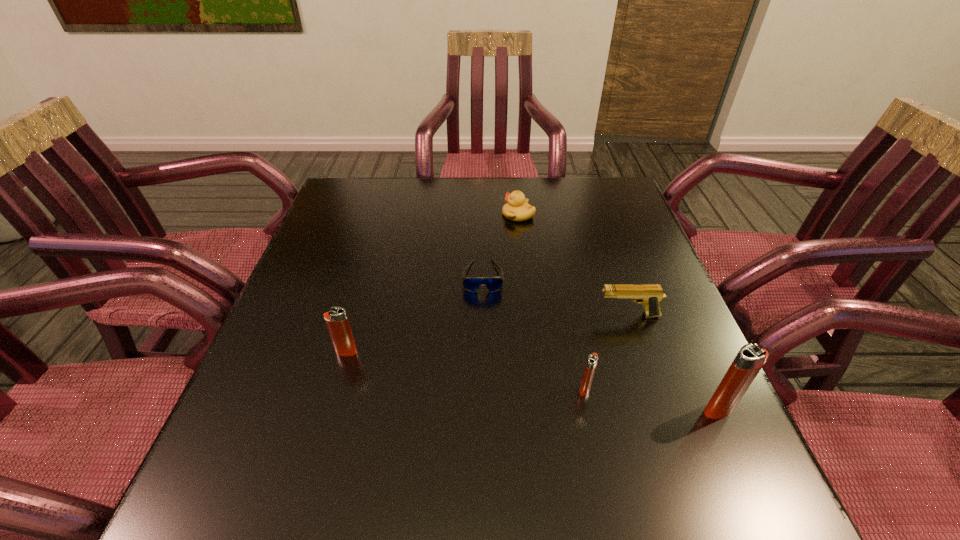
Where is `the second object from left to right`? The image size is (960, 540). the second object from left to right is located at coordinates (471, 283).

The image size is (960, 540). I want to click on the shortest object, so click(x=471, y=283).

This screenshot has height=540, width=960. I want to click on free region located on the back of the fifth shortest object, so click(371, 266).

This screenshot has height=540, width=960. In order to click on vacant space located on the left of the shortest igniter in this screenshot , I will do `click(389, 389)`.

At what (x,y) coordinates should I click in order to perform the action: click on vacant space located on the back of the nearest object. Please return your answer as a coordinate pair (x, y). This screenshot has width=960, height=540. Looking at the image, I should click on (664, 289).

I want to click on vacant space located on the front-facing side of the duckling, so click(x=474, y=215).

Where is `vacant space located on the front-facing side of the duckling`? vacant space located on the front-facing side of the duckling is located at coordinates (470, 215).

Identify the location of vacant space positioned on the front-facing side of the duckling. (395, 215).

Where is `vacant space positioned 0.220m at the barrel of the pistol`? vacant space positioned 0.220m at the barrel of the pistol is located at coordinates (497, 315).

What are the coordinates of `free region located 0.350m at the barrel of the pistol` in the screenshot? It's located at point(439,315).